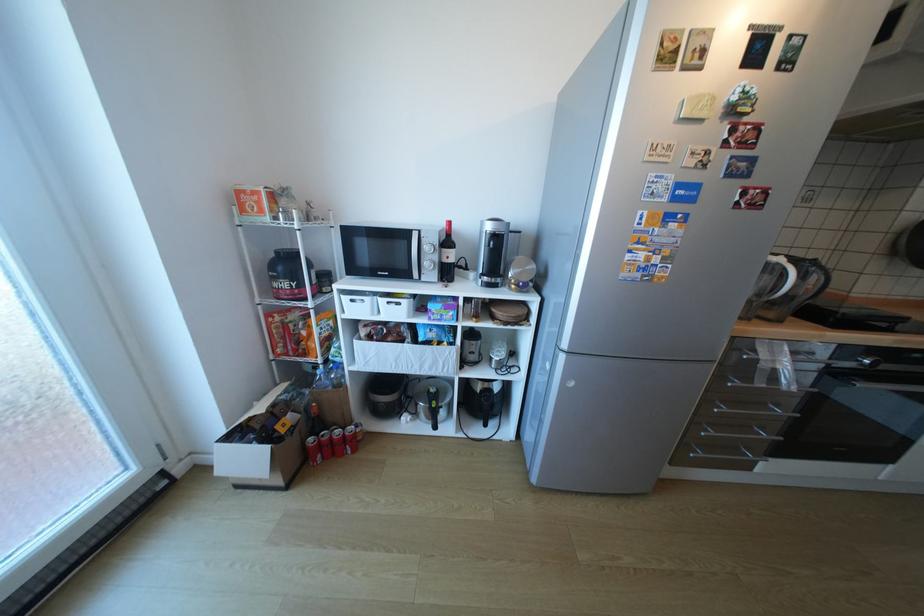
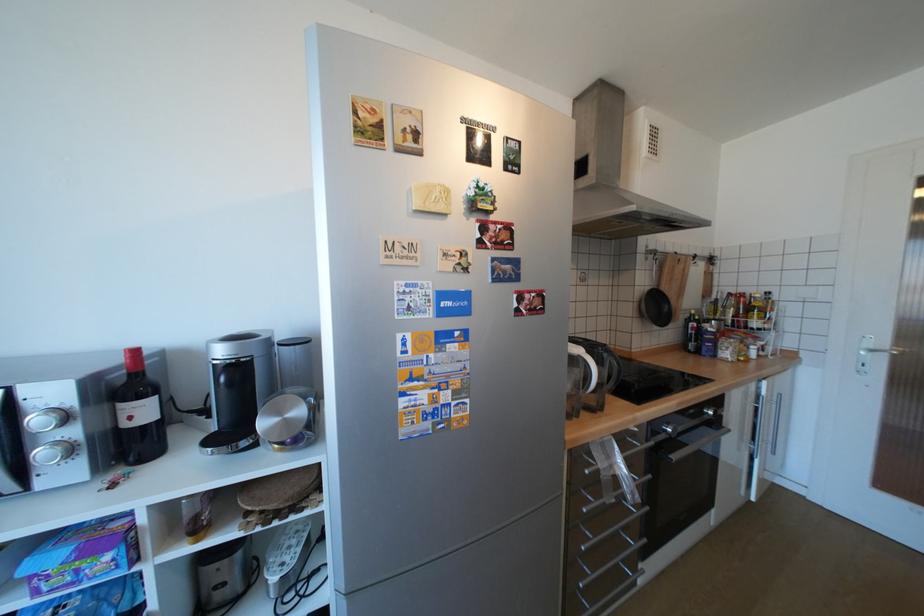
Find the pixel in the second image that matches (x=820, y=262) in the first image.

(612, 350)